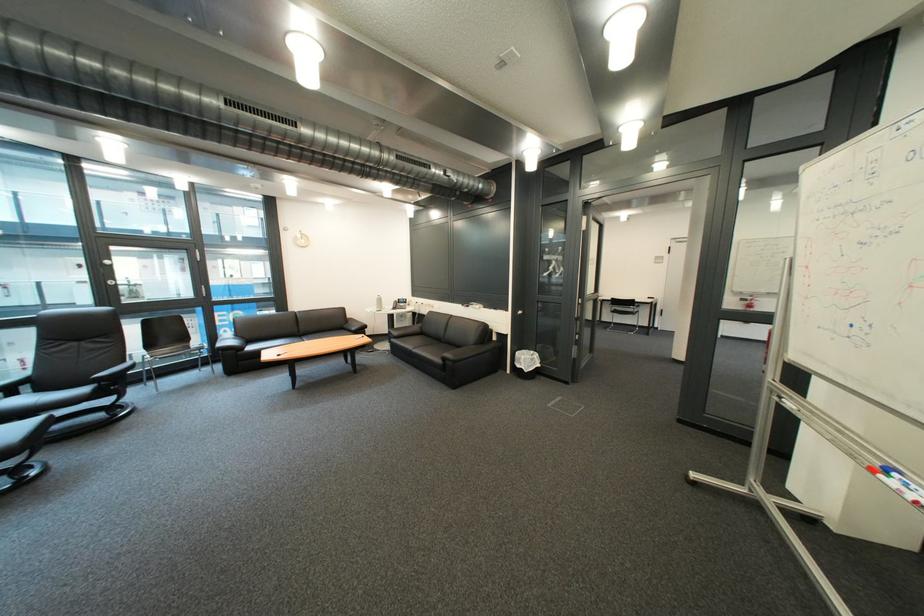
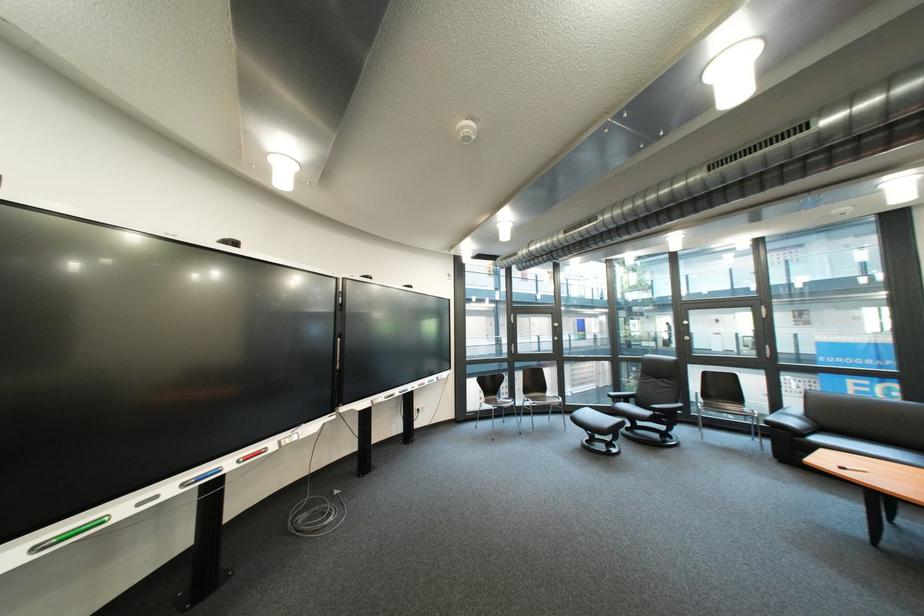
Where in the second image is the point corresponding to point (117, 384) from the first image?

(670, 415)